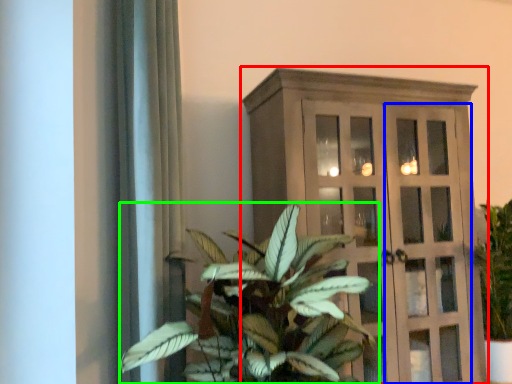
Question: Which is nearer to the cupboard (highlighted by a red box)? screen door (highlighted by a blue box) or houseplant (highlighted by a green box).

Choices:
 (A) screen door
 (B) houseplant

Answer: (A)